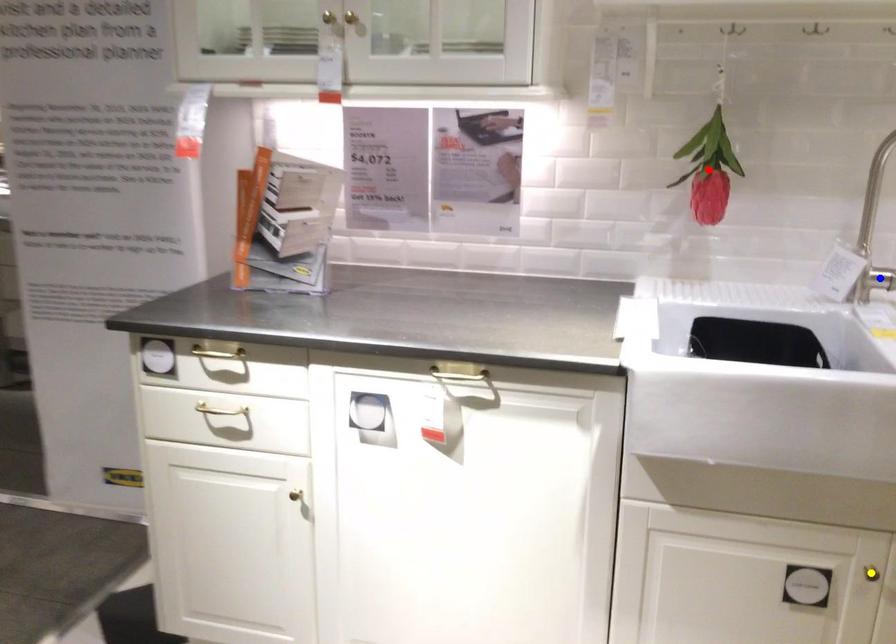
Order these from nearest to farthest:
- red point
- blue point
- yellow point

yellow point
blue point
red point